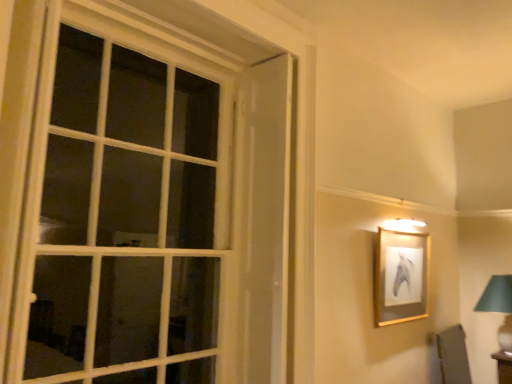
Question: Is white glass window at left in front of gold/glossy picture frame at upper right?

Choices:
 (A) no
 (B) yes

Answer: (B)

Question: From the image's perspective, is white glass window at left under gold/glossy picture frame at upper right?

Choices:
 (A) yes
 (B) no

Answer: (B)

Question: Does white glass window at left have a greater width compared to gold/glossy picture frame at upper right?

Choices:
 (A) no
 (B) yes

Answer: (A)

Question: Is the position of white glass window at left more distant than that of gold/glossy picture frame at upper right?

Choices:
 (A) yes
 (B) no

Answer: (B)

Question: Considering the relative sizes of white glass window at left and gold/glossy picture frame at upper right in the image provided, is white glass window at left smaller than gold/glossy picture frame at upper right?

Choices:
 (A) no
 (B) yes

Answer: (A)

Question: Considering the relative positions of white glass window at left and gold/glossy picture frame at upper right in the image provided, is white glass window at left to the left of gold/glossy picture frame at upper right from the viewer's perspective?

Choices:
 (A) yes
 (B) no

Answer: (A)

Question: From a real-world perspective, does white glass window at left stand above green fabric lampshade at right?

Choices:
 (A) no
 (B) yes

Answer: (B)

Question: Does white glass window at left have a lesser height compared to green fabric lampshade at right?

Choices:
 (A) yes
 (B) no

Answer: (B)

Question: Can you confirm if white glass window at left is wider than green fabric lampshade at right?

Choices:
 (A) yes
 (B) no

Answer: (B)

Question: Is the depth of white glass window at left greater than that of green fabric lampshade at right?

Choices:
 (A) yes
 (B) no

Answer: (B)

Question: Is white glass window at left taller than green fabric lampshade at right?

Choices:
 (A) no
 (B) yes

Answer: (B)

Question: From the image's perspective, is white glass window at left beneath green fabric lampshade at right?

Choices:
 (A) no
 (B) yes

Answer: (A)

Question: Is green fabric lampshade at right touching white glass window at left?

Choices:
 (A) yes
 (B) no

Answer: (B)